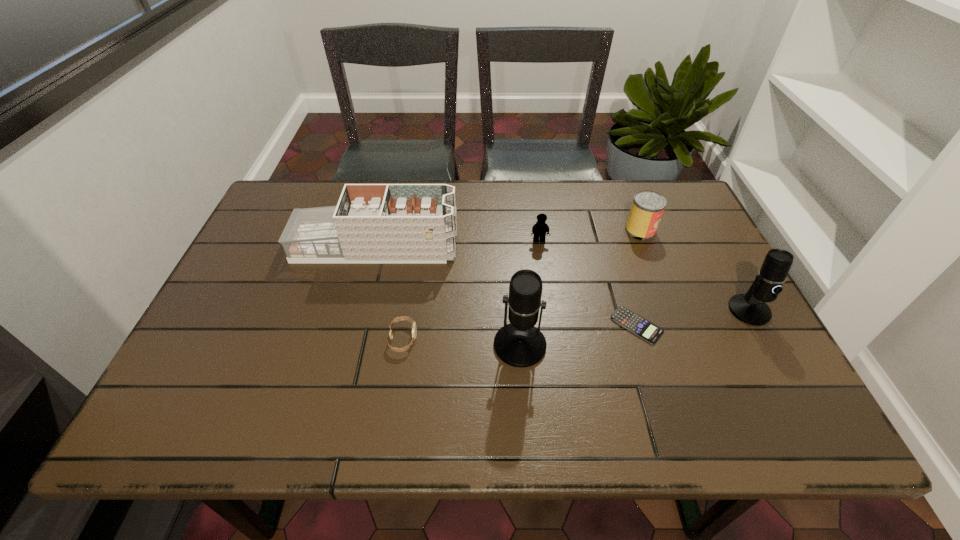
Image resolution: width=960 pixels, height=540 pixels. What are the coordinates of `unoccupied position between the dollhouse and the calculator` in the screenshot? It's located at (506, 286).

The image size is (960, 540). Identify the location of free point between the right microphone and the watch. (576, 325).

The height and width of the screenshot is (540, 960). I want to click on vacant space in between the fourth tallest object and the rightmost object, so click(x=695, y=271).

Find the location of a particular element. The height and width of the screenshot is (540, 960). free space between the fifth tallest object and the dollhouse is located at coordinates (457, 244).

In order to click on empty location between the dollhouse and the tallest object in this screenshot , I will do `click(447, 296)`.

Where is `free space between the third shortest object and the second shortest object`? This screenshot has height=540, width=960. free space between the third shortest object and the second shortest object is located at coordinates (471, 290).

Where is `empty location between the shortest object and the tallest object`? Image resolution: width=960 pixels, height=540 pixels. empty location between the shortest object and the tallest object is located at coordinates (578, 335).

Find the location of a particular element. The width and height of the screenshot is (960, 540). object that is the sixth nearest to the dollhouse is located at coordinates [x=750, y=308].

Identify which object is the closest to the dollhouse. Please provide its 2D coordinates. Your answer should be formatted as a tuple, i.e. [(x, y)], where the tuple contains the x and y coordinates of a point satisfying the conditions above.

[(414, 328)]

I want to click on free region that satisfies the following two spatial constraints: 1. on the face of the second shortest object; 2. on the right side of the left microphone, so click(x=402, y=345).